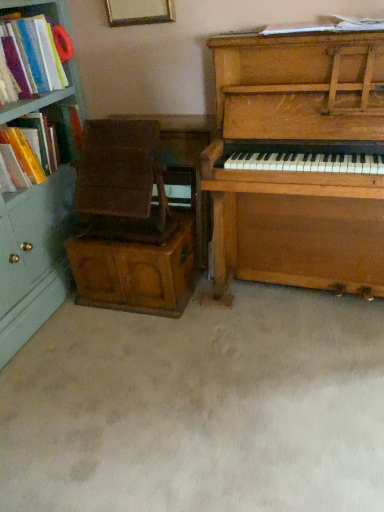
Question: Should I look upward or downward to see wooden piano at right?

Choices:
 (A) down
 (B) up

Answer: (B)

Question: From the image's perspective, is wooden piano at right on wooden armchair at center-left, which ranks as the 2th armchair in top-to-bottom order?

Choices:
 (A) yes
 (B) no

Answer: (A)

Question: Is wooden piano at right next to wooden armchair at center-left, acting as the 1th armchair starting from the bottom?

Choices:
 (A) no
 (B) yes

Answer: (A)

Question: Considering the relative sizes of wooden piano at right and wooden armchair at center-left, acting as the 1th armchair starting from the bottom, in the image provided, is wooden piano at right wider than wooden armchair at center-left, acting as the 1th armchair starting from the bottom,?

Choices:
 (A) yes
 (B) no

Answer: (A)

Question: Is wooden piano at right thinner than wooden armchair at center-left, which ranks as the 2th armchair in top-to-bottom order?

Choices:
 (A) no
 (B) yes

Answer: (A)

Question: Is wooden armchair at center-left, acting as the 1th armchair starting from the bottom, surrounded by wooden piano at right?

Choices:
 (A) yes
 (B) no

Answer: (B)

Question: Is wooden piano at right facing away from wooden armchair at center-left, acting as the 1th armchair starting from the bottom?

Choices:
 (A) no
 (B) yes

Answer: (A)

Question: Is wooden picture frame at upper center at the right side of wooden armchair at center-left, acting as the 1th armchair starting from the bottom?

Choices:
 (A) no
 (B) yes

Answer: (B)

Question: Is wooden picture frame at upper center touching wooden armchair at center-left, which ranks as the 2th armchair in top-to-bottom order?

Choices:
 (A) yes
 (B) no

Answer: (B)

Question: Considering the relative sizes of wooden picture frame at upper center and wooden armchair at center-left, which ranks as the 2th armchair in top-to-bottom order, in the image provided, is wooden picture frame at upper center shorter than wooden armchair at center-left, which ranks as the 2th armchair in top-to-bottom order,?

Choices:
 (A) yes
 (B) no

Answer: (B)

Question: Does wooden picture frame at upper center have a larger size compared to wooden armchair at center-left, which ranks as the 2th armchair in top-to-bottom order?

Choices:
 (A) yes
 (B) no

Answer: (B)

Question: Is wooden picture frame at upper center behind wooden armchair at center-left, acting as the 1th armchair starting from the bottom?

Choices:
 (A) no
 (B) yes

Answer: (A)

Question: Is wooden armchair at center-left, acting as the 1th armchair starting from the bottom, a part of wooden picture frame at upper center?

Choices:
 (A) no
 (B) yes

Answer: (A)

Question: Does matte plastic book at left, the second book when ordered from right to left, appear on the right side of white paper at upper center, positioned as the 3th book in left-to-right order?

Choices:
 (A) no
 (B) yes

Answer: (A)